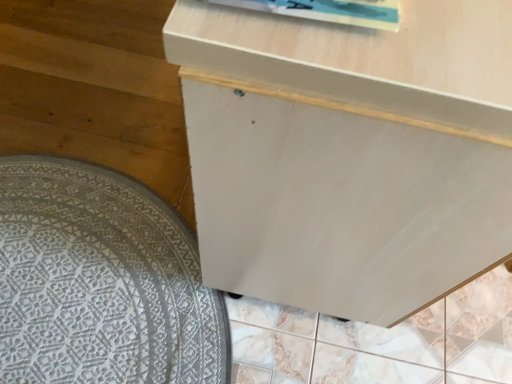
Question: From a real-world perspective, is white matte cabinet at center above or below white textured mat at lower left?

Choices:
 (A) below
 (B) above

Answer: (B)

Question: Considering the relative positions of white matte cabinet at center and white textured mat at lower left in the image provided, is white matte cabinet at center to the left or to the right of white textured mat at lower left?

Choices:
 (A) right
 (B) left

Answer: (A)

Question: Is point (181, 51) closer or farther from the camera than point (189, 274)?

Choices:
 (A) closer
 (B) farther

Answer: (A)

Question: Considering the positions of point (181, 261) and point (314, 87), is point (181, 261) closer or farther from the camera than point (314, 87)?

Choices:
 (A) farther
 (B) closer

Answer: (A)

Question: From a real-world perspective, relative to white matte cabinet at center, is white textured mat at lower left vertically above or below?

Choices:
 (A) below
 (B) above

Answer: (A)

Question: Based on their positions, is white textured mat at lower left located to the left or right of white matte cabinet at center?

Choices:
 (A) left
 (B) right

Answer: (A)

Question: From their relative heights in the image, would you say white textured mat at lower left is taller or shorter than white matte cabinet at center?

Choices:
 (A) short
 (B) tall

Answer: (A)